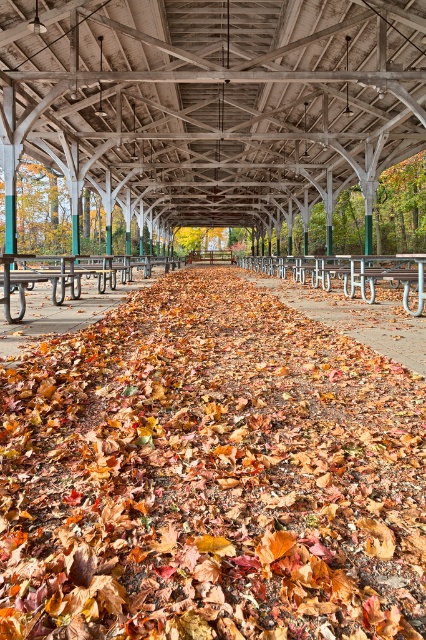
From the picture: Does brown leafy path at center appear under metallic silver bench at center?

Indeed, brown leafy path at center is positioned under metallic silver bench at center.

Does point (419, 355) lie in front of point (353, 257)?

Yes, it is in front of point (353, 257).

Where is `brown leafy path at center`? Image resolution: width=426 pixels, height=640 pixels. brown leafy path at center is located at coordinates (356, 316).

In the scene shown: Which is below, wooden beams at center or brown leafy path at center?

brown leafy path at center

Can you confirm if wooden beams at center is positioned above brown leafy path at center?

Correct, wooden beams at center is located above brown leafy path at center.

Where is `wooden beams at center`? The width and height of the screenshot is (426, 640). wooden beams at center is located at coordinates (213, 100).

Is brown leafy path at center to the left of wooden picnic table at center from the viewer's perspective?

In fact, brown leafy path at center is to the right of wooden picnic table at center.

How much distance is there between brown leafy path at center and wooden picnic table at center?

4.32 meters

Measure the distance between brown leafy path at center and camera.

brown leafy path at center is 3.61 meters from camera.

Where is `brown leafy path at center`? The height and width of the screenshot is (640, 426). brown leafy path at center is located at coordinates (356, 316).